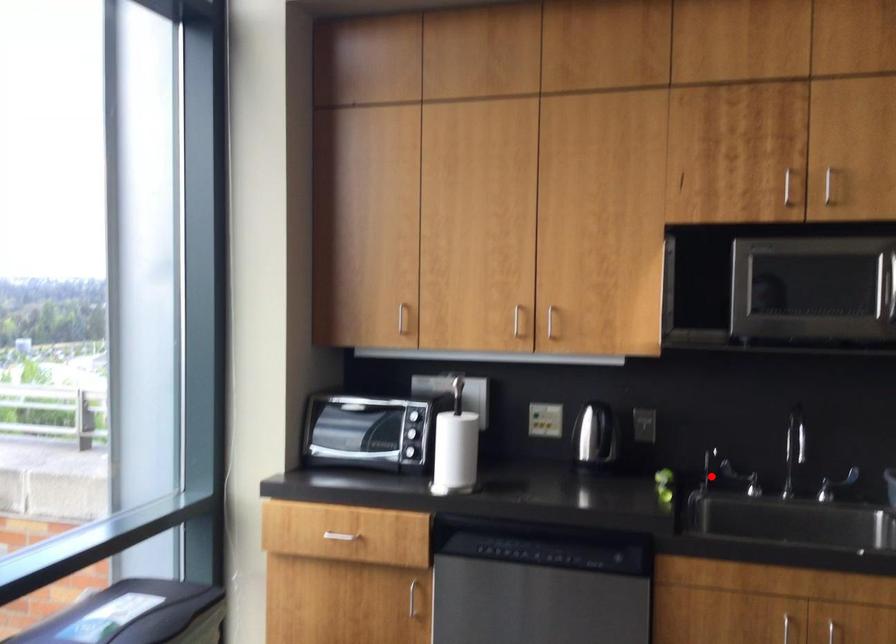
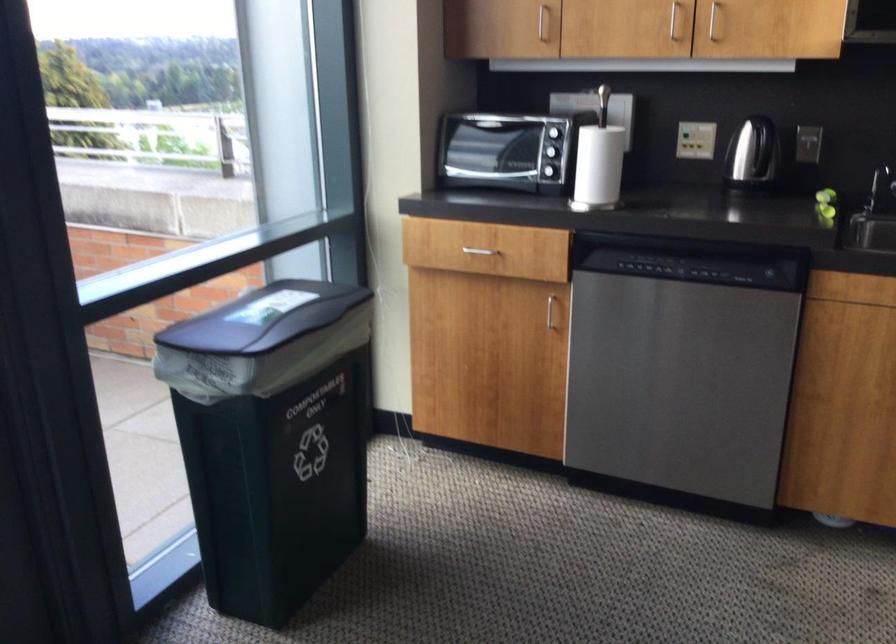
Question: I am providing you with two images of the same scene from different viewpoints. Image1 has a red point marked. In image2, the corresponding 3D location appears at what relative position? Reply with the corresponding letter.

Choices:
 (A) Closer
 (B) Farther

Answer: (A)